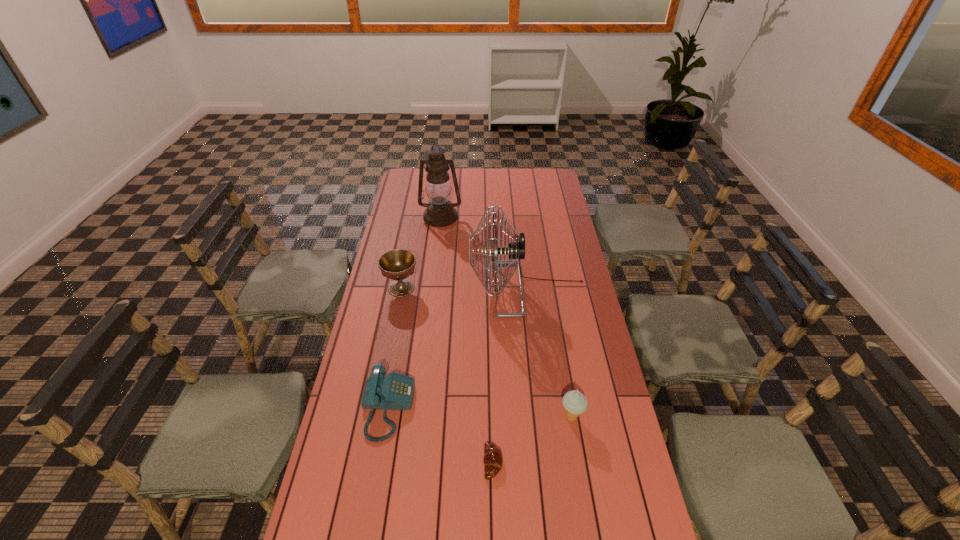
At what (x,y) coordinates should I click in order to perform the action: click on the farthest object. Please return your answer as a coordinate pair (x, y). Looking at the image, I should click on (440, 212).

Locate an element on the screen. This screenshot has height=540, width=960. fan is located at coordinates (516, 250).

Find the location of a particular element. Image resolution: width=960 pixels, height=540 pixels. chalice is located at coordinates (398, 264).

You are a GUI agent. You are given a task and a screenshot of the screen. Output one action in this format:
    pyautogui.click(x=<x>, y=<y>)
    Task: Click on the icecream
    Image resolution: width=960 pixels, height=540 pixels.
    Given the screenshot: What is the action you would take?
    pyautogui.click(x=574, y=402)

Identify the location of telephone. (395, 391).

Locate an element on the screen. The image size is (960, 540). crescent roll is located at coordinates (493, 460).

Identify the location of the nearest object. (493, 460).

At what (x,y) coordinates should I click in order to perform the action: click on free space located 0.280m on the back of the oil lamp. Please return your answer as a coordinate pair (x, y). This screenshot has height=540, width=960. Looking at the image, I should click on pyautogui.click(x=444, y=179).

The image size is (960, 540). What are the coordinates of `free point located 0.070m on the front-facing side of the fan` in the screenshot? It's located at (452, 289).

The image size is (960, 540). Find the location of `free space located on the front-facing side of the fan`. free space located on the front-facing side of the fan is located at coordinates (415, 289).